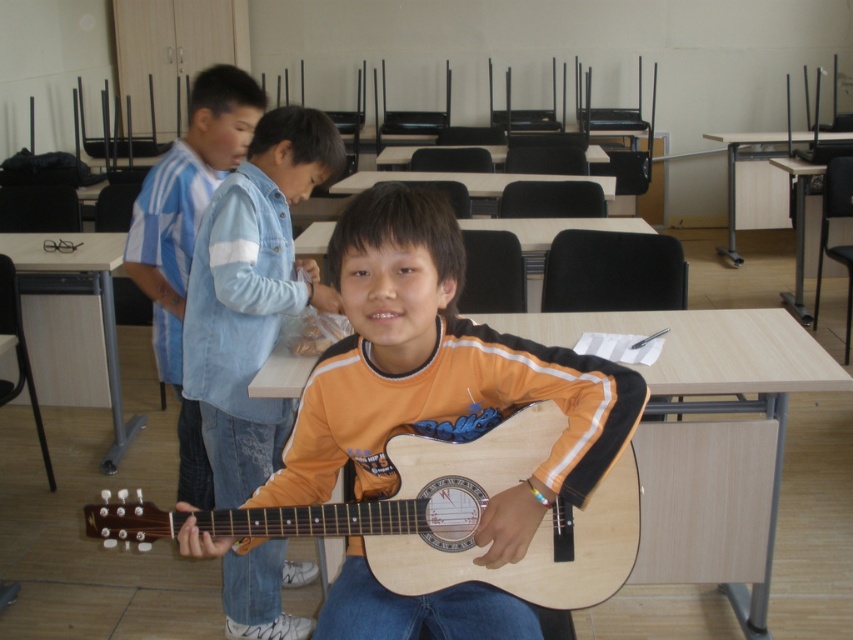
Question: Which of these objects is positioned closest to the orange matte guitar at center?

Choices:
 (A) wooden guitar at center
 (B) natural wood guitar at center

Answer: (A)

Question: Can you confirm if wooden guitar at center is positioned above orange matte guitar at center?

Choices:
 (A) no
 (B) yes

Answer: (A)

Question: Based on their relative distances, which object is nearer to the orange matte guitar at center?

Choices:
 (A) natural wood guitar at center
 (B) wooden guitar at center

Answer: (B)

Question: Does wooden guitar at center have a smaller size compared to orange matte guitar at center?

Choices:
 (A) no
 (B) yes

Answer: (B)

Question: Which object appears closest to the camera in this image?

Choices:
 (A) natural wood guitar at center
 (B) wooden guitar at center

Answer: (B)

Question: Can you confirm if wooden guitar at center is positioned below natural wood guitar at center?

Choices:
 (A) no
 (B) yes

Answer: (A)